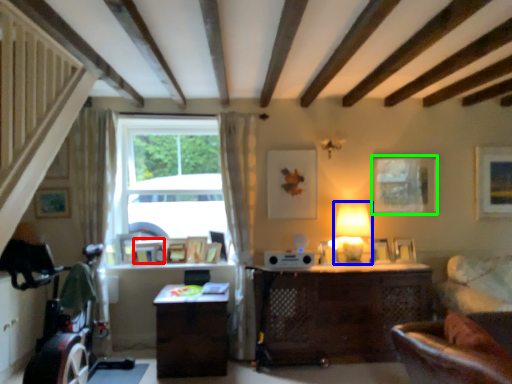
Question: Which is farther away from picture frame (highlighted by a red box)? table lamp (highlighted by a blue box) or picture frame (highlighted by a green box)?

Choices:
 (A) table lamp
 (B) picture frame

Answer: (B)